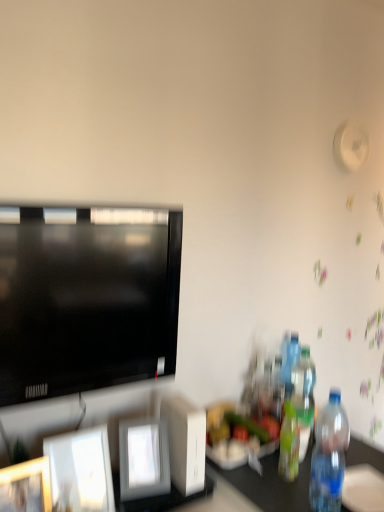
In order to face wooden picture frame at lower left, arranged as the 1th picture frame when viewed from the left, should I rotate leftwards or rightwards?

A 22.110 degree turn to the left will do.

This screenshot has width=384, height=512. What do you see at coordinates (87, 300) in the screenshot? I see `matte black television at left` at bounding box center [87, 300].

Find the location of a particular element. Image resolution: width=384 pixels, height=512 pixels. white glossy picture frame at lower left, the second picture frame from the left is located at coordinates (80, 471).

Find the location of a particular element. The height and width of the screenshot is (512, 384). translucent plastic bottle at right, marked as the 1th bottle in a back-to-front arrangement is located at coordinates (289, 360).

Measure the distance between point (x=157, y=473) and camera.

Point (x=157, y=473) and camera are 4.04 feet apart from each other.

How much space does transparent plastic bottle at right, which ranks as the 1th bottle in front-to-back order, occupy horizontally?

transparent plastic bottle at right, which ranks as the 1th bottle in front-to-back order, is 4.14 inches wide.

What is the approximate height of transparent plastic bottle at right, the fourth bottle in the back-to-front sequence?

12.73 inches.

This screenshot has height=512, width=384. I want to click on wooden picture frame at lower left, arranged as the 1th picture frame when viewed from the left, so click(26, 487).

Is translucent plastic bottle at right, the 4th bottle viewed from the front, in contact with wooden picture frame at lower left, arranged as the 1th picture frame when viewed from the left?

No, translucent plastic bottle at right, the 4th bottle viewed from the front, is not touching wooden picture frame at lower left, arranged as the 1th picture frame when viewed from the left.

Considering the positions of points (292, 335) and (12, 496), is point (292, 335) farther from camera compared to point (12, 496)?

That is True.

From the image's perspective, is translucent plastic bottle at right, marked as the 1th bottle in a back-to-front arrangement, on top of wooden picture frame at lower left, arranged as the 1th picture frame when viewed from the left?

Indeed, from the image's perspective, translucent plastic bottle at right, marked as the 1th bottle in a back-to-front arrangement, is shown above wooden picture frame at lower left, arranged as the 1th picture frame when viewed from the left.

Is the position of white glossy picture frame at lower left, the second picture frame from the left, more distant than that of translucent plastic bottle at right, which is the second bottle from front to back?

No, it is not.

Are white glossy picture frame at lower left, positioned as the 2th picture frame in right-to-left order, and translucent plastic bottle at right, the 3th bottle viewed from the back, located far from each other?

No, white glossy picture frame at lower left, positioned as the 2th picture frame in right-to-left order, is in close proximity to translucent plastic bottle at right, the 3th bottle viewed from the back.

From the white glossy picture frame at lower left, positioned as the 2th picture frame in right-to-left order, count 2nd bottles backward and point to it. Please provide its 2D coordinates.

[(289, 444)]

Is white glossy picture frame at lower left, the second picture frame from the left, facing away from translucent plastic bottle at right, the 3th bottle viewed from the back?

No, translucent plastic bottle at right, the 3th bottle viewed from the back, is not at the back of white glossy picture frame at lower left, the second picture frame from the left.

Which object is positioned more to the left, matte black television at left or white glossy picture frame at lower left, positioned as the 2th picture frame in right-to-left order?

white glossy picture frame at lower left, positioned as the 2th picture frame in right-to-left order.

Does matte black television at left have a greater height compared to white glossy picture frame at lower left, positioned as the 2th picture frame in right-to-left order?

Indeed, matte black television at left has a greater height compared to white glossy picture frame at lower left, positioned as the 2th picture frame in right-to-left order.

Which object is closer to the camera taking this photo, matte black television at left or white glossy picture frame at lower left, the second picture frame from the left?

matte black television at left is in front.

Between white glossy picture frame at center, marked as the 1th picture frame in a right-to-left arrangement, and translucent plastic bottle at right, the 4th bottle viewed from the front, which one appears on the right side from the viewer's perspective?

translucent plastic bottle at right, the 4th bottle viewed from the front, is more to the right.

Consider the image. In terms of height, does white glossy picture frame at center, the 3th picture frame in the left-to-right sequence, look taller or shorter compared to translucent plastic bottle at right, marked as the 1th bottle in a back-to-front arrangement?

Considering their sizes, white glossy picture frame at center, the 3th picture frame in the left-to-right sequence, has less height than translucent plastic bottle at right, marked as the 1th bottle in a back-to-front arrangement.

Is white glossy picture frame at center, marked as the 1th picture frame in a right-to-left arrangement, not within translucent plastic bottle at right, marked as the 1th bottle in a back-to-front arrangement?

Absolutely, white glossy picture frame at center, marked as the 1th picture frame in a right-to-left arrangement, is external to translucent plastic bottle at right, marked as the 1th bottle in a back-to-front arrangement.

What's the angular difference between translucent plastic bottle at right, marked as the 1th bottle in a back-to-front arrangement, and white glossy picture frame at center, marked as the 1th picture frame in a right-to-left arrangement,'s facing directions?

The angle between the facing direction of translucent plastic bottle at right, marked as the 1th bottle in a back-to-front arrangement, and the facing direction of white glossy picture frame at center, marked as the 1th picture frame in a right-to-left arrangement, is 16 degrees.

Which is behind, translucent plastic bottle at right, marked as the 1th bottle in a back-to-front arrangement, or white glossy picture frame at center, the 3th picture frame in the left-to-right sequence?

translucent plastic bottle at right, marked as the 1th bottle in a back-to-front arrangement.

Looking at this image, considering the relative sizes of translucent plastic bottle at right, marked as the 1th bottle in a back-to-front arrangement, and white glossy picture frame at center, marked as the 1th picture frame in a right-to-left arrangement, in the image provided, is translucent plastic bottle at right, marked as the 1th bottle in a back-to-front arrangement, wider than white glossy picture frame at center, marked as the 1th picture frame in a right-to-left arrangement,?

No.

Is translucent plastic bottle at right, marked as the 1th bottle in a back-to-front arrangement, taller or shorter than white glossy picture frame at center, marked as the 1th picture frame in a right-to-left arrangement?

In the image, translucent plastic bottle at right, marked as the 1th bottle in a back-to-front arrangement, appears to be taller than white glossy picture frame at center, marked as the 1th picture frame in a right-to-left arrangement.

From the image's perspective, between wooden picture frame at lower left, the third picture frame when ordered from right to left, and translucent plastic bottle at right, the third bottle positioned from the front, who is located below?

From the image's view, wooden picture frame at lower left, the third picture frame when ordered from right to left, is below.

Considering the relative sizes of wooden picture frame at lower left, the third picture frame when ordered from right to left, and translucent plastic bottle at right, the 2th bottle when ordered from back to front, in the image provided, is wooden picture frame at lower left, the third picture frame when ordered from right to left, thinner than translucent plastic bottle at right, the 2th bottle when ordered from back to front,?

Yes.

Can you confirm if translucent plastic bottle at right, marked as the 1th bottle in a back-to-front arrangement, is shorter than white glossy picture frame at lower left, positioned as the 2th picture frame in right-to-left order?

Incorrect, the height of translucent plastic bottle at right, marked as the 1th bottle in a back-to-front arrangement, does not fall short of that of white glossy picture frame at lower left, positioned as the 2th picture frame in right-to-left order.

Which is more to the right, translucent plastic bottle at right, the 4th bottle viewed from the front, or white glossy picture frame at lower left, the second picture frame from the left?

translucent plastic bottle at right, the 4th bottle viewed from the front.

From the picture: Is translucent plastic bottle at right, marked as the 1th bottle in a back-to-front arrangement, in front of or behind white glossy picture frame at lower left, positioned as the 2th picture frame in right-to-left order, in the image?

Visually, translucent plastic bottle at right, marked as the 1th bottle in a back-to-front arrangement, is located behind white glossy picture frame at lower left, positioned as the 2th picture frame in right-to-left order.

Identify the location of picture frame that is the 3rd one when counting downward from the translucent plastic bottle at right, the 4th bottle viewed from the front (from the image's perspective). Image resolution: width=384 pixels, height=512 pixels. (26, 487).

From a real-world perspective, which bottle is the 1st one above the white glossy picture frame at lower left, the second picture frame from the left? Please provide its 2D coordinates.

[(289, 444)]

Estimate the real-world distances between objects in this image. Which object is further from translucent plastic bottle at right, the 4th bottle viewed from the front, matte black television at left or white glossy picture frame at center, the 3th picture frame in the left-to-right sequence?

matte black television at left is further to translucent plastic bottle at right, the 4th bottle viewed from the front.

Which object lies further to the anchor point white glossy picture frame at lower left, the second picture frame from the left, transparent plastic bottle at right, the fourth bottle in the back-to-front sequence, or translucent plastic bottle at right, the 3th bottle viewed from the back?

transparent plastic bottle at right, the fourth bottle in the back-to-front sequence.

Based on their spatial positions, is white glossy picture frame at lower left, the second picture frame from the left, or matte black television at left further from white glossy picture frame at center, the 3th picture frame in the left-to-right sequence?

Among the two, matte black television at left is located further to white glossy picture frame at center, the 3th picture frame in the left-to-right sequence.

Estimate the real-world distances between objects in this image. Which object is further from wooden picture frame at lower left, arranged as the 1th picture frame when viewed from the left, white glossy picture frame at lower left, positioned as the 2th picture frame in right-to-left order, or matte black television at left?

matte black television at left is positioned further to the anchor wooden picture frame at lower left, arranged as the 1th picture frame when viewed from the left.

Estimate the real-world distances between objects in this image. Which object is further from matte black television at left, wooden picture frame at lower left, arranged as the 1th picture frame when viewed from the left, or translucent plastic bottle at right, marked as the 1th bottle in a back-to-front arrangement?

translucent plastic bottle at right, marked as the 1th bottle in a back-to-front arrangement.

From the image, which object appears to be nearer to white glossy picture frame at center, marked as the 1th picture frame in a right-to-left arrangement, translucent plastic bottle at right, the 4th bottle viewed from the front, or transparent plastic bottle at right, the fourth bottle in the back-to-front sequence?

transparent plastic bottle at right, the fourth bottle in the back-to-front sequence.

From the image, which object appears to be farther from matte black television at left, translucent plastic bottle at right, which is the second bottle from front to back, or white glossy picture frame at center, marked as the 1th picture frame in a right-to-left arrangement?

The object further to matte black television at left is translucent plastic bottle at right, which is the second bottle from front to back.

From the image, which object appears to be nearer to transparent plastic bottle at right, the fourth bottle in the back-to-front sequence, white glossy picture frame at lower left, positioned as the 2th picture frame in right-to-left order, or translucent plastic bottle at right, the third bottle positioned from the front?

Based on the image, translucent plastic bottle at right, the third bottle positioned from the front, appears to be nearer to transparent plastic bottle at right, the fourth bottle in the back-to-front sequence.

At what (x,y) coordinates should I click in order to perform the action: click on television located between wooden picture frame at lower left, the third picture frame when ordered from right to left, and translucent plastic bottle at right, the 4th bottle viewed from the front, in the left-right direction. Please return your answer as a coordinate pair (x, y). Looking at the image, I should click on (87, 300).

The height and width of the screenshot is (512, 384). I want to click on picture frame between white glossy picture frame at lower left, positioned as the 2th picture frame in right-to-left order, and transparent plastic bottle at right, the fourth bottle in the back-to-front sequence, so click(x=143, y=459).

Find the location of a particular element. This screenshot has width=384, height=512. picture frame between matte black television at left and transparent plastic bottle at right, which ranks as the 1th bottle in front-to-back order is located at coordinates (143, 459).

This screenshot has width=384, height=512. I want to click on picture frame located between transparent plastic bottle at right, the fourth bottle in the back-to-front sequence, and translucent plastic bottle at right, marked as the 1th bottle in a back-to-front arrangement, in the depth direction, so click(143, 459).